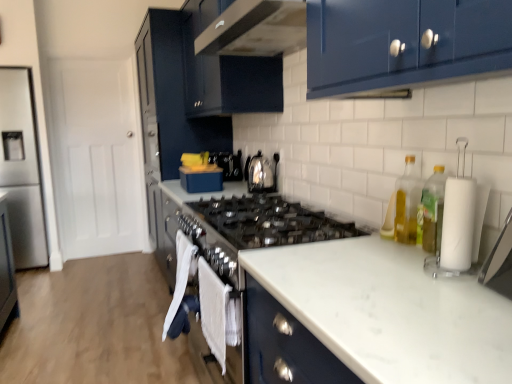
Question: Considering the relative positions of satin stainless steel refrigerator at left and clear glass bottle at right, arranged as the second bottle when viewed from the front, in the image provided, is satin stainless steel refrigerator at left in front of clear glass bottle at right, arranged as the second bottle when viewed from the front,?

Choices:
 (A) no
 (B) yes

Answer: (A)

Question: Can you confirm if satin stainless steel refrigerator at left is taller than clear glass bottle at right, arranged as the second bottle when viewed from the front?

Choices:
 (A) yes
 (B) no

Answer: (A)

Question: Is satin stainless steel refrigerator at left not within clear glass bottle at right, the first bottle from the back?

Choices:
 (A) no
 (B) yes

Answer: (B)

Question: Is satin stainless steel refrigerator at left at the left side of clear glass bottle at right, the first bottle from the back?

Choices:
 (A) yes
 (B) no

Answer: (A)

Question: Is satin stainless steel refrigerator at left turned away from clear glass bottle at right, the first bottle from the back?

Choices:
 (A) yes
 (B) no

Answer: (B)

Question: From the image's perspective, is satin stainless steel refrigerator at left above clear glass bottle at right, arranged as the second bottle when viewed from the front?

Choices:
 (A) yes
 (B) no

Answer: (A)

Question: Considering the relative sizes of white towel at lower center and yellow translucent bottle at right, placed as the second bottle when sorted from back to front, in the image provided, is white towel at lower center wider than yellow translucent bottle at right, placed as the second bottle when sorted from back to front,?

Choices:
 (A) no
 (B) yes

Answer: (A)

Question: Are white towel at lower center and yellow translucent bottle at right, placed as the second bottle when sorted from back to front, making contact?

Choices:
 (A) yes
 (B) no

Answer: (B)

Question: Does white towel at lower center lie behind yellow translucent bottle at right, placed as the second bottle when sorted from back to front?

Choices:
 (A) no
 (B) yes

Answer: (B)

Question: Is white towel at lower center positioned before yellow translucent bottle at right, placed as the second bottle when sorted from back to front?

Choices:
 (A) no
 (B) yes

Answer: (A)

Question: Does white towel at lower center have a greater height compared to yellow translucent bottle at right, marked as the first bottle in a front-to-back arrangement?

Choices:
 (A) no
 (B) yes

Answer: (B)

Question: Considering the relative sizes of white towel at lower center and yellow translucent bottle at right, placed as the second bottle when sorted from back to front, in the image provided, is white towel at lower center smaller than yellow translucent bottle at right, placed as the second bottle when sorted from back to front,?

Choices:
 (A) no
 (B) yes

Answer: (A)

Question: Considering the relative sizes of glossy dark blue cabinet at center, which appears as the 1th cabinetry when viewed from the back, and yellow translucent bottle at right, placed as the second bottle when sorted from back to front, in the image provided, is glossy dark blue cabinet at center, which appears as the 1th cabinetry when viewed from the back, bigger than yellow translucent bottle at right, placed as the second bottle when sorted from back to front,?

Choices:
 (A) yes
 (B) no

Answer: (A)